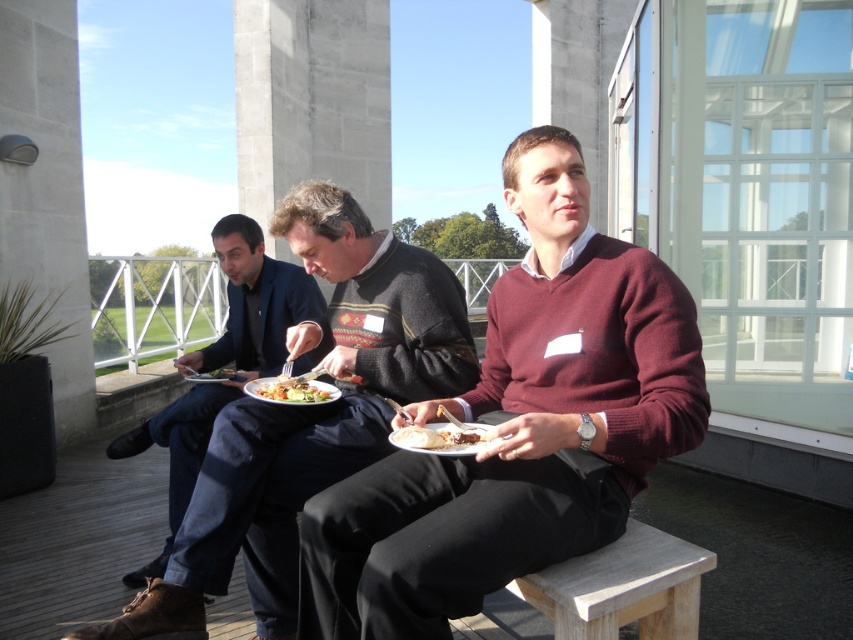
Between burgundy sweater at center and matte plastic plate at center, which one has more height?

burgundy sweater at center is taller.

Between burgundy sweater at center and matte plastic plate at center, which one appears on the right side from the viewer's perspective?

From the viewer's perspective, burgundy sweater at center appears more on the right side.

Which is in front, point (579, 371) or point (308, 388)?

Point (579, 371) is more forward.

Identify the location of burgundy sweater at center. This screenshot has height=640, width=853. (518, 426).

Does point (621, 380) come closer to viewer compared to point (442, 312)?

Yes.

Is point (558, 216) positioned after point (343, 456)?

No.

Is point (621, 269) positioned after point (196, 506)?

No, it is in front of (196, 506).

The width and height of the screenshot is (853, 640). In order to click on burgundy sweater at center in this screenshot , I will do `click(518, 426)`.

What do you see at coordinates (292, 388) in the screenshot? The width and height of the screenshot is (853, 640). I see `matte plastic plate at center` at bounding box center [292, 388].

Can you confirm if matte plastic plate at center is smaller than vibrant mixed vegetables at center?

No, matte plastic plate at center is not smaller than vibrant mixed vegetables at center.

Is point (322, 403) positioned in front of point (308, 397)?

Yes, point (322, 403) is in front of point (308, 397).

The height and width of the screenshot is (640, 853). I want to click on matte plastic plate at center, so click(x=292, y=388).